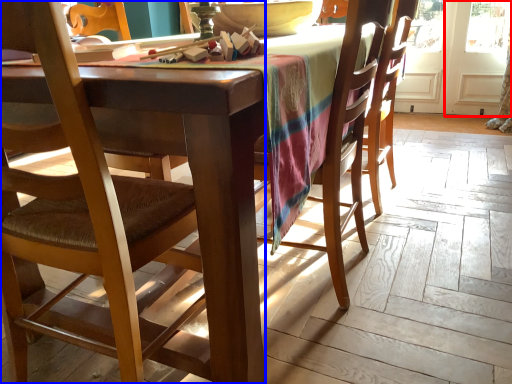
Question: Which object is further to the camera taking this photo, screen door (highlighted by a red box) or chair (highlighted by a blue box)?

Choices:
 (A) screen door
 (B) chair

Answer: (A)